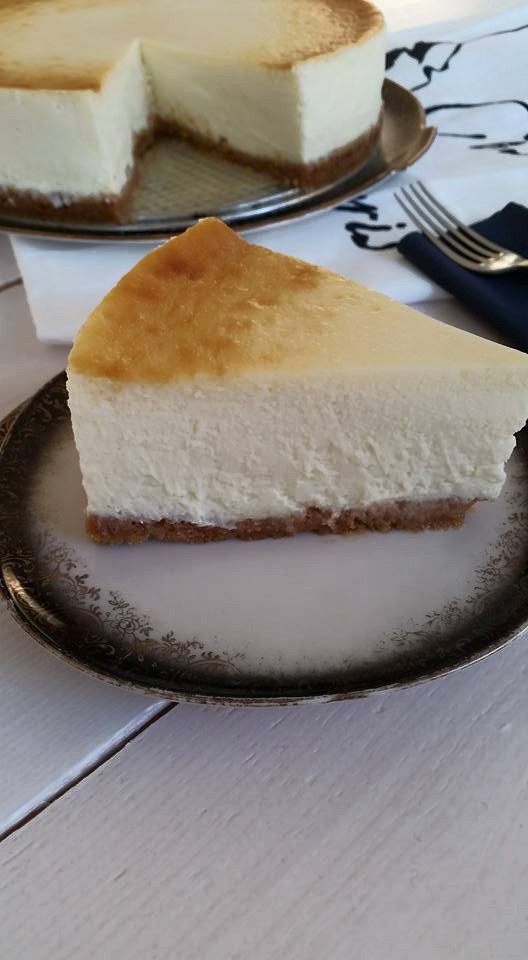
Where is `table`? This screenshot has width=528, height=960. table is located at coordinates [x=232, y=842], [x=16, y=355].